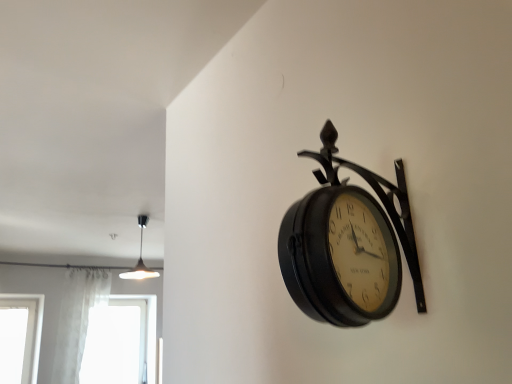
What do you see at coordinates (121, 342) in the screenshot? I see `transparent glass window at lower left` at bounding box center [121, 342].

In order to face matte black clock at upper right, should I rotate leftwards or rightwards?

To face it directly, rotate right by 13.168 degrees.

The image size is (512, 384). I want to click on matte black clock at upper right, so click(x=347, y=244).

Find the location of `matte black pendant light at upper left`. matte black pendant light at upper left is located at coordinates (140, 258).

At what (x,y) coordinates should I click in order to perform the action: click on transparent glass window at lower left. Please return your answer as a coordinate pair (x, y). The width and height of the screenshot is (512, 384). Looking at the image, I should click on click(x=121, y=342).

Can you confirm if transparent glass window at lower left is wider than matte black pendant light at upper left?

No, transparent glass window at lower left is not wider than matte black pendant light at upper left.

Could you measure the distance between transparent glass window at lower left and matte black pendant light at upper left?

transparent glass window at lower left is 82.04 centimeters away from matte black pendant light at upper left.

Does point (115, 316) come in front of point (158, 273)?

No, (115, 316) is further to viewer.

Consider the image. Is matte black clock at upper right spatially inside matte black pendant light at upper left, or outside of it?

matte black clock at upper right is spatially situated outside matte black pendant light at upper left.

Consider the image. In the image, is matte black clock at upper right on the left side or the right side of matte black pendant light at upper left?

Based on their positions, matte black clock at upper right is located to the right of matte black pendant light at upper left.

Is point (364, 168) positioned after point (139, 257)?

No, (364, 168) is in front of (139, 257).

Looking at the image, does matte black clock at upper right seem bigger or smaller compared to matte black pendant light at upper left?

Considering their sizes, matte black clock at upper right takes up less space than matte black pendant light at upper left.

From the image's perspective, which one is positioned higher, matte black clock at upper right or white sheer curtain at lower left?

matte black clock at upper right is shown above in the image.

How many degrees apart are the facing directions of matte black clock at upper right and white sheer curtain at lower left?

matte black clock at upper right and white sheer curtain at lower left are facing 180 degrees away from each other.

Is matte black clock at upper right at the right side of white sheer curtain at lower left?

Correct, you'll find matte black clock at upper right to the right of white sheer curtain at lower left.

Considering the positions of objects matte black clock at upper right and white sheer curtain at lower left in the image provided, who is in front, matte black clock at upper right or white sheer curtain at lower left?

matte black clock at upper right is more forward.

Is matte black pendant light at upper left looking in the opposite direction of transparent glass window at lower left?

No, transparent glass window at lower left is not at the back of matte black pendant light at upper left.

From the image's perspective, which is below, matte black pendant light at upper left or transparent glass window at lower left?

From the image's view, transparent glass window at lower left is below.

Considering the relative sizes of matte black pendant light at upper left and transparent glass window at lower left in the image provided, is matte black pendant light at upper left wider than transparent glass window at lower left?

Yes.

Is point (141, 228) closer or farther from the camera than point (141, 374)?

Point (141, 228).

From a real-world perspective, between transparent glass window at lower left and matte black clock at upper right, who is vertically higher?

matte black clock at upper right is physically above.

Does transparent glass window at lower left appear on the left side of matte black clock at upper right?

Indeed, transparent glass window at lower left is positioned on the left side of matte black clock at upper right.

Can you tell me how much transparent glass window at lower left and matte black clock at upper right differ in facing direction?

The facing directions of transparent glass window at lower left and matte black clock at upper right are 179 degrees apart.

Choose the correct answer: Is transparent glass window at lower left inside matte black clock at upper right or outside it?

transparent glass window at lower left is located beyond the bounds of matte black clock at upper right.

Is white sheer curtain at lower left closer to camera compared to matte black pendant light at upper left?

No, white sheer curtain at lower left is further to the viewer.

Is white sheer curtain at lower left not within matte black pendant light at upper left?

Yes, white sheer curtain at lower left is not within matte black pendant light at upper left.

Is white sheer curtain at lower left at the left side of matte black pendant light at upper left?

Yes, white sheer curtain at lower left is to the left of matte black pendant light at upper left.

Is white sheer curtain at lower left bigger than matte black pendant light at upper left?

Indeed, white sheer curtain at lower left has a larger size compared to matte black pendant light at upper left.

Which object is further away from the camera, transparent glass window at lower left or white sheer curtain at lower left?

Positioned behind is transparent glass window at lower left.

This screenshot has width=512, height=384. Find the location of `curtain located above the transparent glass window at lower left (from a real-world perspective)`. curtain located above the transparent glass window at lower left (from a real-world perspective) is located at coordinates (77, 319).

From a real-world perspective, which is physically below, transparent glass window at lower left or white sheer curtain at lower left?

transparent glass window at lower left is physically lower.

Locate an element on the screen. This screenshot has width=512, height=384. window below the matte black pendant light at upper left (from a real-world perspective) is located at coordinates (121, 342).

I want to click on wall clock on the right of matte black pendant light at upper left, so click(x=347, y=244).

Looking at the image, which one is located further to white sheer curtain at lower left, transparent glass window at lower left or matte black pendant light at upper left?

Among the two, matte black pendant light at upper left is located further to white sheer curtain at lower left.

When comparing their distances from matte black clock at upper right, does white sheer curtain at lower left or matte black pendant light at upper left seem further?

white sheer curtain at lower left is positioned further to the anchor matte black clock at upper right.

Considering their positions, is matte black clock at upper right positioned further to transparent glass window at lower left than matte black pendant light at upper left?

matte black clock at upper right is further to transparent glass window at lower left.

Looking at the image, which one is located further to transparent glass window at lower left, white sheer curtain at lower left or matte black pendant light at upper left?

Based on the image, matte black pendant light at upper left appears to be further to transparent glass window at lower left.

Looking at the image, which one is located further to matte black clock at upper right, white sheer curtain at lower left or transparent glass window at lower left?

transparent glass window at lower left.

Which object lies nearer to the anchor point transparent glass window at lower left, matte black pendant light at upper left or white sheer curtain at lower left?

Among the two, white sheer curtain at lower left is located nearer to transparent glass window at lower left.

Looking at the image, which one is located further to transparent glass window at lower left, matte black clock at upper right or white sheer curtain at lower left?

matte black clock at upper right.

Which object lies nearer to the anchor point white sheer curtain at lower left, matte black pendant light at upper left or transparent glass window at lower left?

The object closer to white sheer curtain at lower left is transparent glass window at lower left.

Identify the location of lamp between matte black clock at upper right and transparent glass window at lower left from front to back. (140, 258).

Locate an element on the screen. The height and width of the screenshot is (384, 512). curtain located between matte black clock at upper right and transparent glass window at lower left in the depth direction is located at coordinates (77, 319).

What are the coordinates of `curtain between matte black pendant light at upper left and transparent glass window at lower left from front to back` in the screenshot? It's located at (77, 319).

Where is `lamp between matte black clock at upper right and white sheer curtain at lower left in the front-back direction`? This screenshot has width=512, height=384. lamp between matte black clock at upper right and white sheer curtain at lower left in the front-back direction is located at coordinates (140, 258).